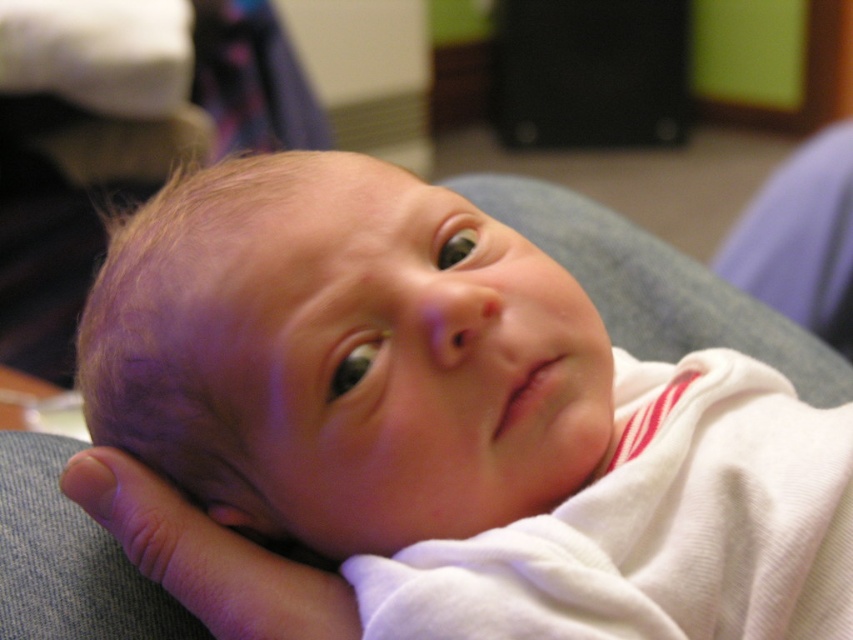
You are a photographer setting up for a baby photoshoot. You have a white soft baby at center and a smooth skin hand at lower left in your frame. Based on their positions, which object is closer to the camera?

The white soft baby at center is positioned over the smooth skin hand at lower left, meaning it is closer to the camera.

You are a photographer taking a closeup shot of the white soft baby at center and the smooth skin hand at lower left. Which object is closer to the camera?

The white soft baby at center is closer to the camera than the smooth skin hand at lower left because it is in front of it.

You are a photographer standing in front of the white soft baby at center. You want to take a photo of the baby from a distance that is exactly 13.35 inches. Is your current position suitable for taking the photo?

Yes, since the white soft baby at center and the viewer are exactly 13.35 inches apart, your current position is suitable for taking the photo at that distance.